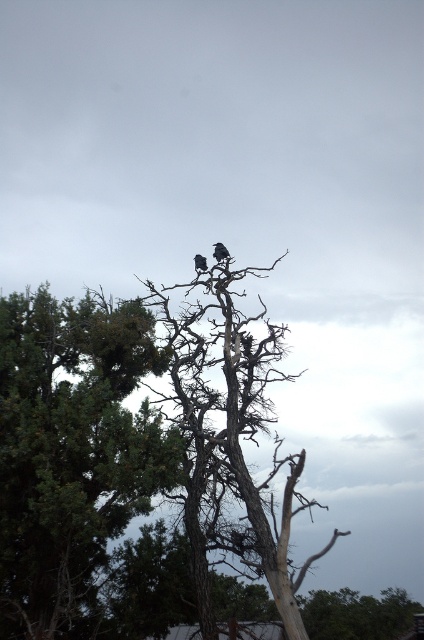
What do you see at coordinates (220, 252) in the screenshot? The width and height of the screenshot is (424, 640). I see `dark gray feathers at center` at bounding box center [220, 252].

Between point (220, 259) and point (204, 262), which one is positioned in front?

Point (220, 259)

Find the location of a particular element. dark gray feathers at center is located at coordinates (220, 252).

Who is positioned more to the right, dead wood tree at center or dark gray feathers at center?

dead wood tree at center

Which is behind, point (228, 452) or point (222, 253)?

Point (222, 253)

Who is more distant from viewer, (301, 465) or (215, 257)?

Point (215, 257)

Identify the location of dead wood tree at center. (231, 435).

Find the location of a particular element. This screenshot has height=640, width=424. green leafy tree at upper center is located at coordinates (72, 452).

In the scene shown: Who is shorter, green leafy tree at upper center or dead wood tree at center?

green leafy tree at upper center is shorter.

This screenshot has width=424, height=640. What do you see at coordinates (72, 452) in the screenshot?
I see `green leafy tree at upper center` at bounding box center [72, 452].

You are a GUI agent. You are given a task and a screenshot of the screen. Output one action in this format:
    pyautogui.click(x=<x>, y=<y>)
    Task: Click on the green leafy tree at upper center
    The image size is (424, 640).
    Given the screenshot: What is the action you would take?
    pyautogui.click(x=72, y=452)